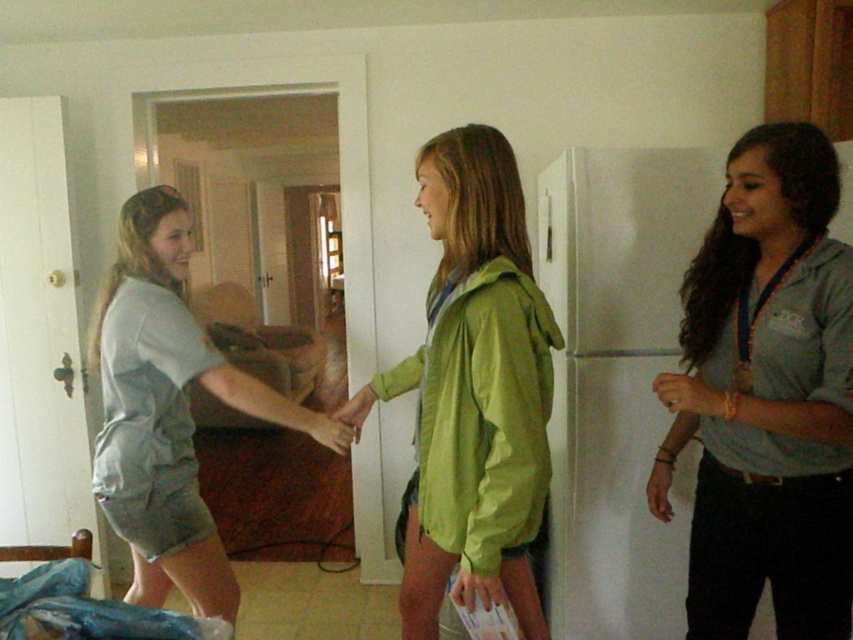
Who is positioned more to the left, green matte jacket at center or gray cotton shirt at left?

Positioned to the left is gray cotton shirt at left.

Describe the element at coordinates (473, 392) in the screenshot. The image size is (853, 640). I see `green matte jacket at center` at that location.

Is point (462, 564) behind point (183, 550)?

No, (462, 564) is closer to viewer.

Where is `green matte jacket at center`? green matte jacket at center is located at coordinates (473, 392).

Is green matte jacket at center taller than matte green jacket at center?

Correct, green matte jacket at center is much taller as matte green jacket at center.

Which is more to the left, green matte jacket at center or matte green jacket at center?

From the viewer's perspective, matte green jacket at center appears more on the left side.

The width and height of the screenshot is (853, 640). What are the coordinates of `green matte jacket at center` in the screenshot? It's located at (473, 392).

Is gray fabric shirt at right closer to the viewer compared to matte green jacket at center?

Yes, gray fabric shirt at right is closer to the viewer.

This screenshot has width=853, height=640. What are the coordinates of `gray fabric shirt at right` in the screenshot? It's located at (767, 396).

Where is `gray fabric shirt at right`? The height and width of the screenshot is (640, 853). gray fabric shirt at right is located at coordinates (767, 396).